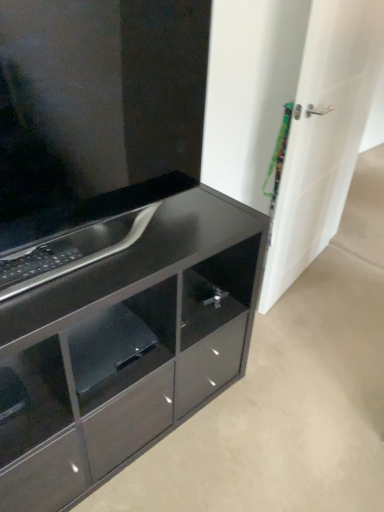
What are the coordinates of `free spot above glossy black cabinet at lower left (from a real-world perspective)` in the screenshot? It's located at (122, 241).